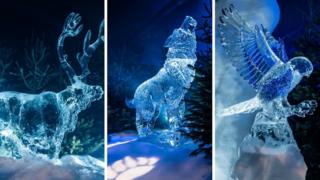
Locate an element on the screen. sculpture base is located at coordinates (271, 125), (164, 136), (40, 158).